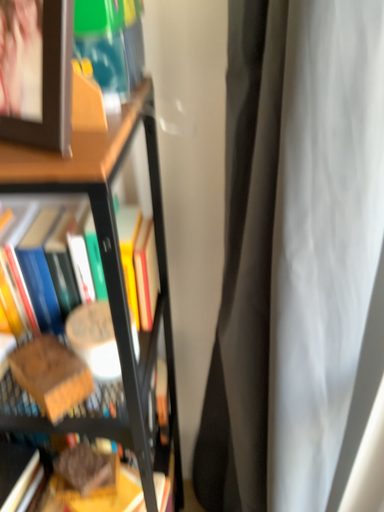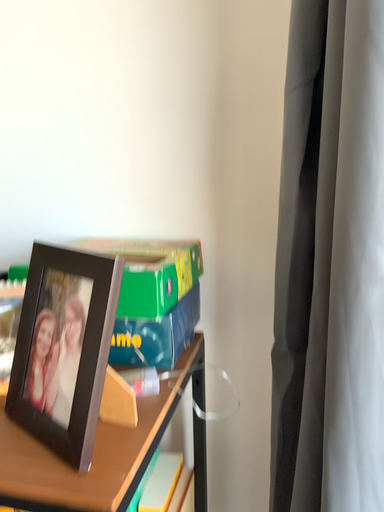
Question: How did the camera likely rotate when shooting the video?

Choices:
 (A) rotated downward
 (B) rotated upward

Answer: (B)